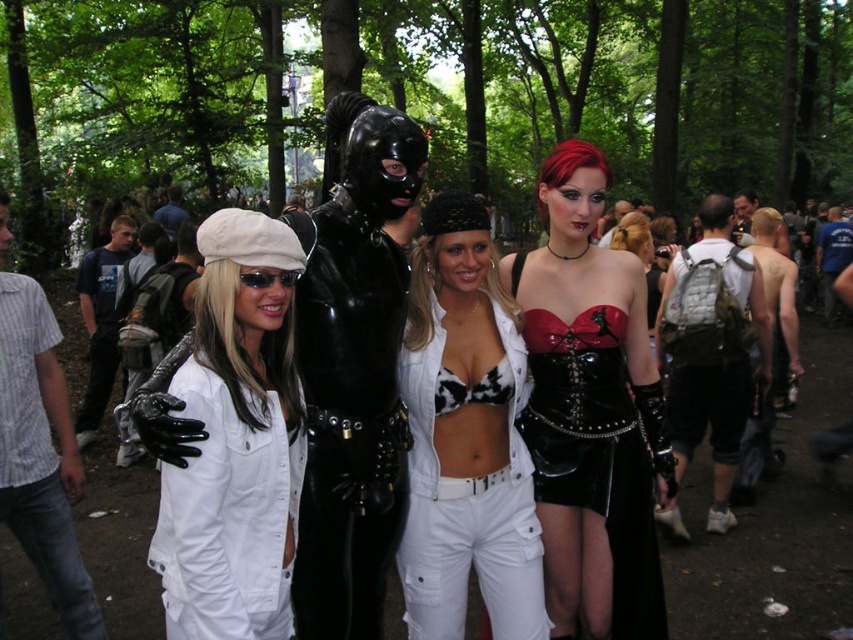
Question: Which object appears closest to the camera in this image?

Choices:
 (A) matte black corset at center
 (B) cow print bra at center
 (C) shiny black corset at center
 (D) white matte jumpsuit at center

Answer: (D)

Question: Estimate the real-world distances between objects in this image. Which object is farther from the shiny black corset at center?

Choices:
 (A) white matte jumpsuit at center
 (B) matte black corset at center

Answer: (B)

Question: Can you confirm if shiny black corset at center is wider than matte black corset at center?

Choices:
 (A) yes
 (B) no

Answer: (A)

Question: Which point is closer to the camera?

Choices:
 (A) white matte jumpsuit at center
 (B) cow print bra at center

Answer: (A)

Question: Where is white matte jumpsuit at center located in relation to matte black corset at center in the image?

Choices:
 (A) right
 (B) left

Answer: (B)

Question: Does cow print bra at center have a greater width compared to matte black corset at center?

Choices:
 (A) yes
 (B) no

Answer: (B)